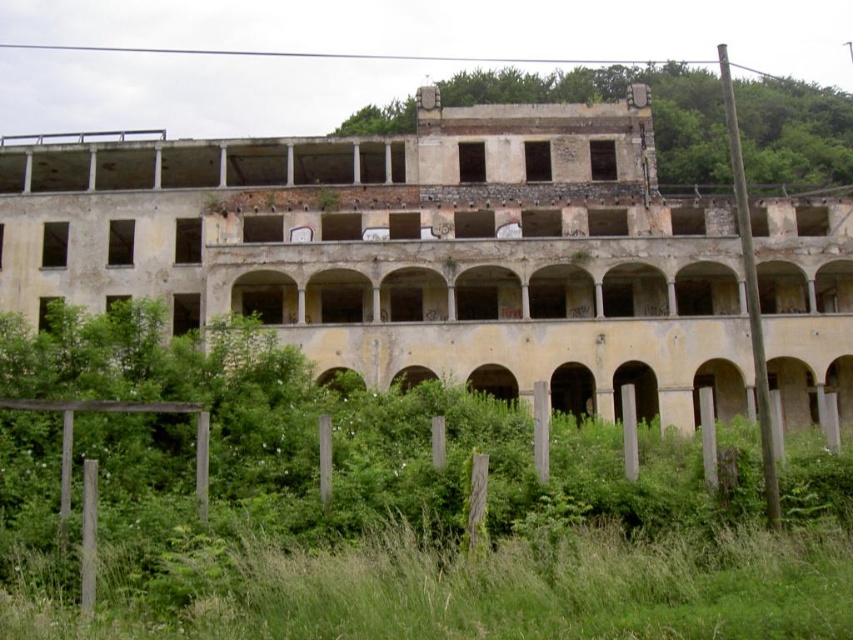
You are standing at the point marked at coordinates (387,509) in the image. Based on the scene description, what type of terrain are you currently standing on?

The point at (387,509) is on green grass at lower center, so you are standing on green grass.

You are a maintenance worker tasked with trimming the green grass at lower center and the green grass at center. Which area should you tackle first if you want to start from the closest point to your current position at the entrance of the building?

You should start with the green grass at lower center because it is located below the green grass at center, meaning it is closer to your current position at the entrance of the building.

You are standing in front of the abandoned building and notice two patches of green grass. One is labeled as green grass at lower center and the other as green grass at center. From your perspective, which grass patch is positioned to the left?

The green grass at lower center is to the left of green grass at center.